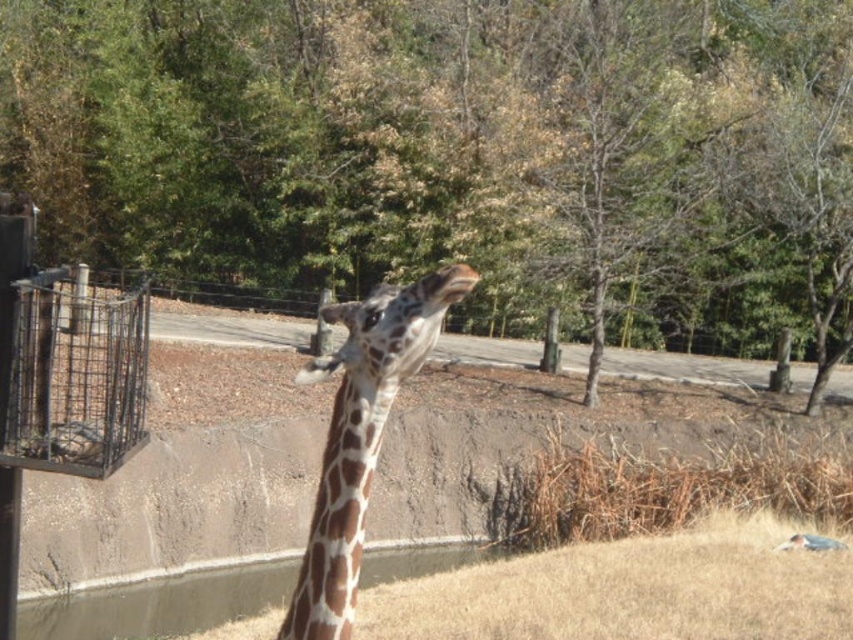
Question: Which point is closer to the camera taking this photo?

Choices:
 (A) (3, 509)
 (B) (387, 372)

Answer: (B)

Question: Can you confirm if green leafy tree at upper center is positioned below metal wire bird feeder at left?

Choices:
 (A) yes
 (B) no

Answer: (B)

Question: Is metal wire bird feeder at left bigger than metal wire basket at left?

Choices:
 (A) yes
 (B) no

Answer: (A)

Question: Among these objects, which one is farthest from the camera?

Choices:
 (A) brown spotted giraffe at center
 (B) spotted fur head at center
 (C) metal wire basket at left
 (D) green leafy tree at upper center

Answer: (D)

Question: From the image, what is the correct spatial relationship of green leafy tree at upper center in relation to spotted fur head at center?

Choices:
 (A) below
 (B) above

Answer: (B)

Question: Which of the following is the farthest from the observer?

Choices:
 (A) green leafy tree at upper center
 (B) metal wire basket at left
 (C) spotted fur head at center
 (D) brown spotted giraffe at center

Answer: (A)